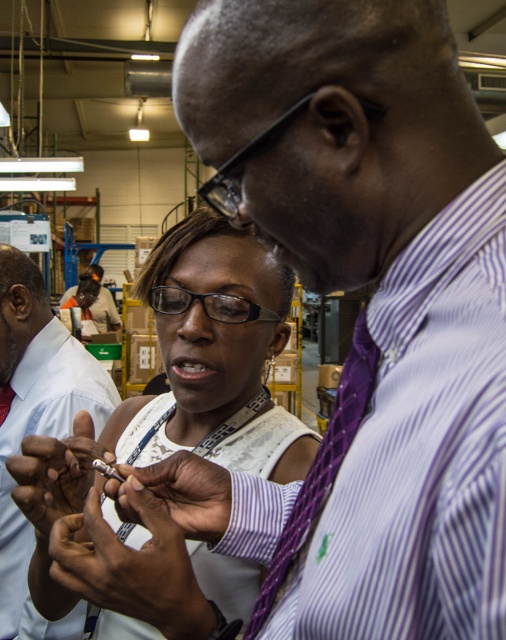
Who is higher up, purple woven tie at center or metallic silver ring at center?

purple woven tie at center is higher up.

Who is more distant from viewer, (322,481) or (192,484)?

The point (192,484) is behind.

Describe the element at coordinates (322, 464) in the screenshot. I see `purple woven tie at center` at that location.

Where is `purple woven tie at center`? This screenshot has width=506, height=640. purple woven tie at center is located at coordinates (322, 464).

Can you confirm if white fabric shirt at center is positioned to the right of matte silver pen at center?

Yes, white fabric shirt at center is to the right of matte silver pen at center.

Between white fabric shirt at center and matte silver pen at center, which one appears on the left side from the viewer's perspective?

matte silver pen at center

Does point (93, 621) come in front of point (75, 481)?

No, it is behind (75, 481).

Find the location of a particular element. white fabric shirt at center is located at coordinates (170, 445).

Is purple striped shirt at center positioned before purple woven tie at center?

No.

Does point (11, 563) come behind point (293, 506)?

Yes, point (11, 563) is behind point (293, 506).

This screenshot has width=506, height=640. What are the coordinates of `purple striped shirt at center` in the screenshot? It's located at (35, 420).